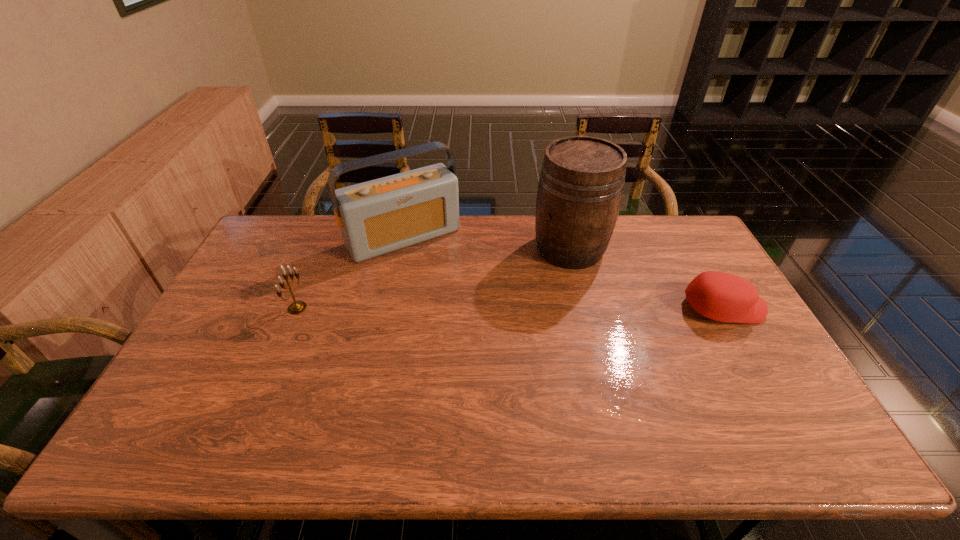
Where is `vacant space located 0.250m on the front-facing side of the radio receiver`? The height and width of the screenshot is (540, 960). vacant space located 0.250m on the front-facing side of the radio receiver is located at coordinates (462, 307).

Locate an element on the screen. The height and width of the screenshot is (540, 960). free space located on the front-facing side of the radio receiver is located at coordinates (462, 307).

At what (x,y) coordinates should I click in order to perform the action: click on free space located 0.210m on the front-facing side of the radio receiver. Please return your answer as a coordinate pair (x, y). This screenshot has height=540, width=960. Looking at the image, I should click on (455, 299).

In order to click on cider situated at the far edge in this screenshot , I will do `click(580, 189)`.

Locate an element on the screen. The width and height of the screenshot is (960, 540). radio receiver at the far edge is located at coordinates (376, 217).

This screenshot has height=540, width=960. I want to click on object that is at the right edge, so click(x=724, y=297).

What are the coordinates of `free space at the far edge of the desktop` in the screenshot? It's located at (530, 228).

You are a GUI agent. You are given a task and a screenshot of the screen. Output one action in this format:
    pyautogui.click(x=<x>, y=<y>)
    Task: Click on the vacant space at the left edge of the desktop
    
    Given the screenshot: What is the action you would take?
    pyautogui.click(x=256, y=299)

Locate an element on the screen. vacant space at the right edge of the desktop is located at coordinates (696, 266).

You are a GUI agent. You are given a task and a screenshot of the screen. Output one action in this format:
    pyautogui.click(x=<x>, y=<y>)
    Task: Click on the vacant space at the far left corner
    
    Given the screenshot: What is the action you would take?
    pyautogui.click(x=292, y=247)